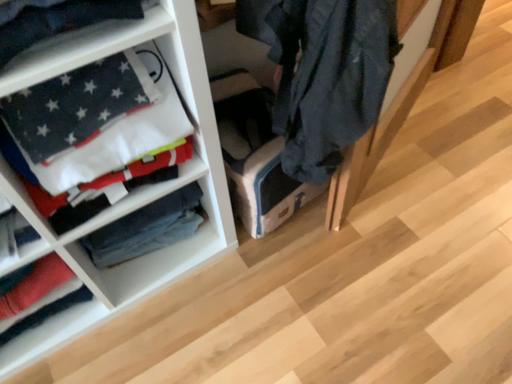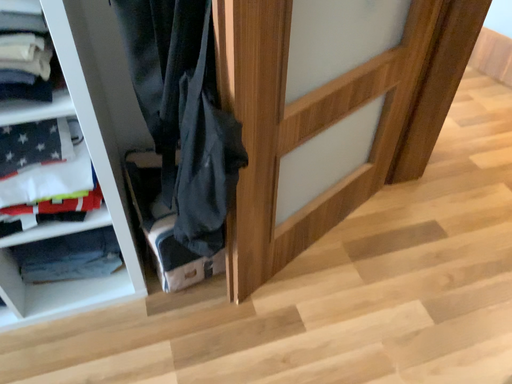
Question: How did the camera likely rotate when shooting the video?

Choices:
 (A) rotated upward
 (B) rotated downward

Answer: (A)